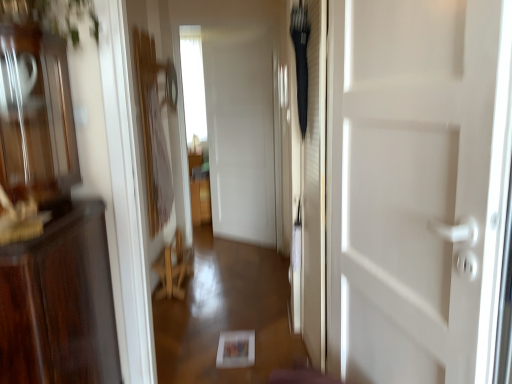
Identify the location of vacant area in front of wooden chair at center. This screenshot has width=512, height=384. (185, 301).